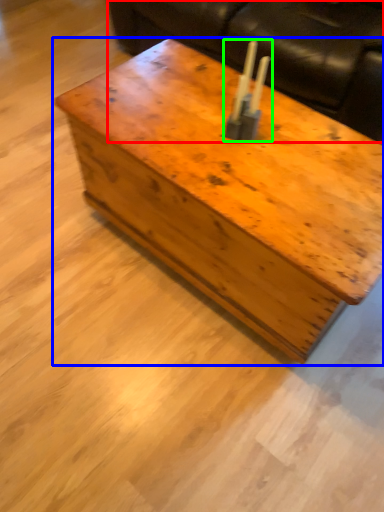
Question: Estimate the real-world distances between objects in this image. Which object is farther from couch (highlighted by a red box), table (highlighted by a blue box) or candle holder (highlighted by a green box)?

Choices:
 (A) table
 (B) candle holder

Answer: (B)